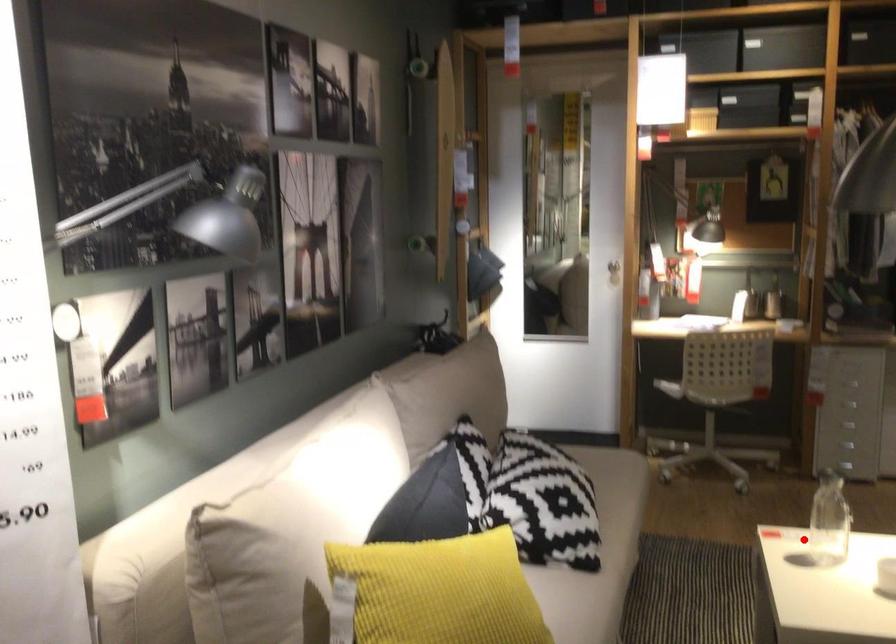
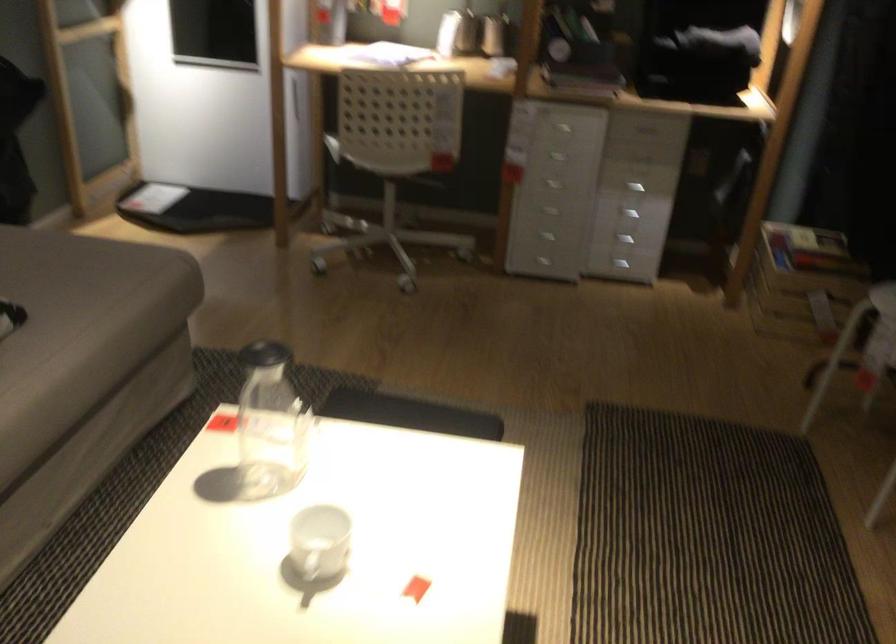
The point at the highlighted location is marked in the first image. Where is the corresponding point in the second image?

(270, 424)